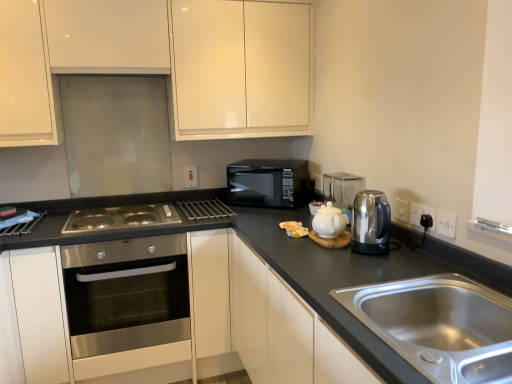
Locate an element on the screen. free spot above polished stainless steel cooktop at lower left (from a real-world perspective) is located at coordinates (126, 219).